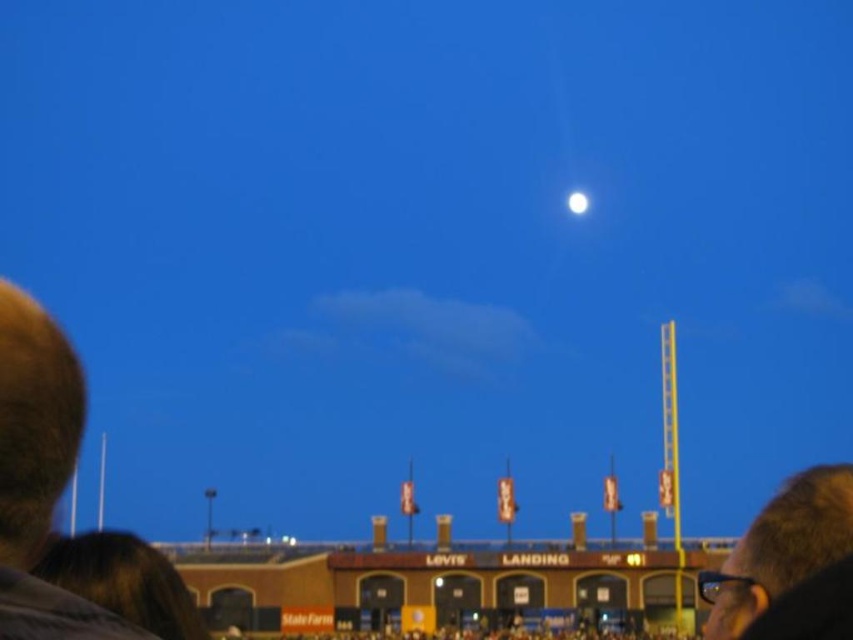
You are a photographer trying to capture a clear shot of the brown hair at left and the bright white sphere at upper center. Which object should you focus on first if you want to ensure both are in focus, considering their sizes?

The brown hair at left has a larger size compared to the bright white sphere at upper center. You should focus on the brown hair at left first since it is larger and might require more precise focusing to capture details.

You are a photographer trying to capture a clear shot of the dark brown hair at upper right and the bright white sphere at upper center. Based on their positions, which object is closer to the bottom of the image?

The dark brown hair at upper right is positioned under the bright white sphere at upper center, so it is closer to the bottom of the image.